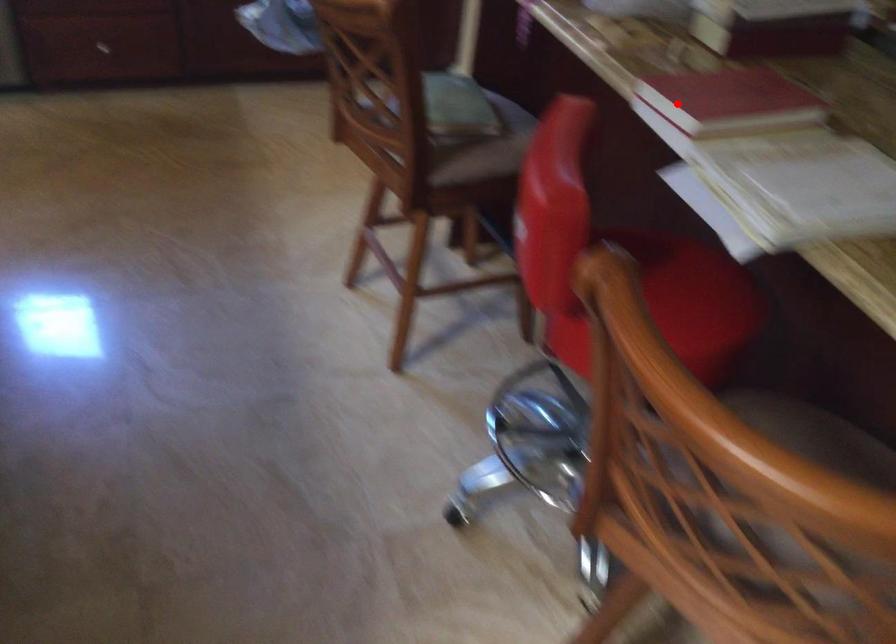
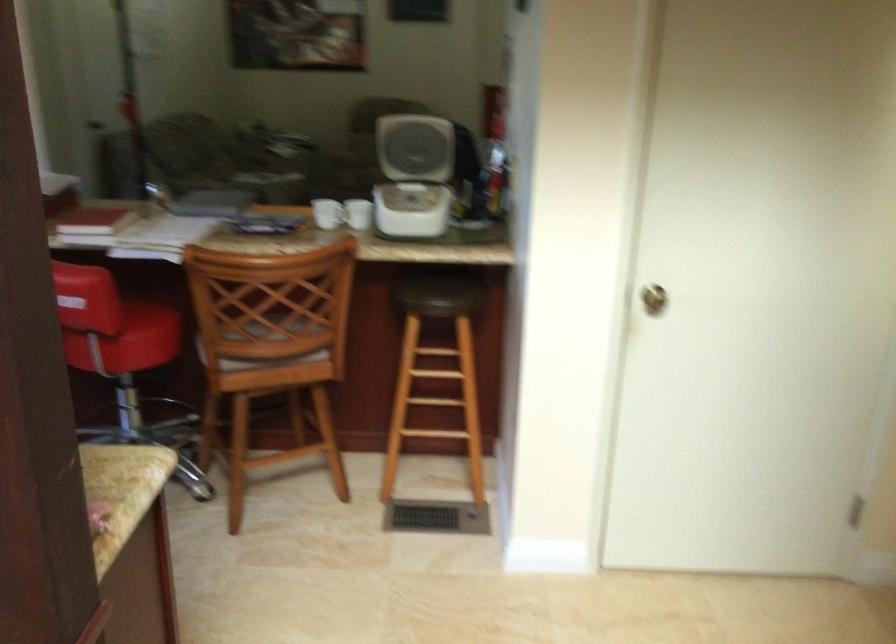
In the second image, find the point that corresponds to the highlighted location in the first image.

(93, 223)